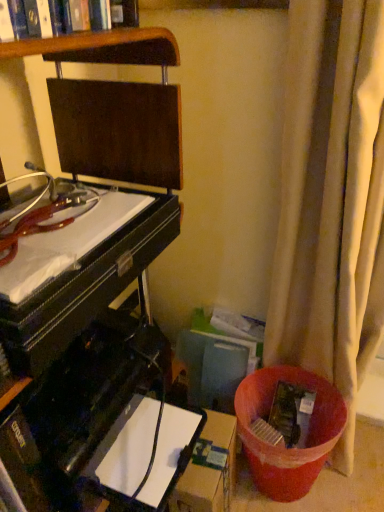
Question: From a real-world perspective, relative to beige fabric curtain at right, is black glossy computer desk at left vertically above or below?

Choices:
 (A) below
 (B) above

Answer: (B)

Question: Would you say black glossy computer desk at left is inside or outside beige fabric curtain at right?

Choices:
 (A) outside
 (B) inside

Answer: (A)

Question: Which object is the closest to the beige fabric curtain at right?

Choices:
 (A) black glossy computer desk at left
 (B) brown cardboard box at lower center

Answer: (A)

Question: Based on their relative distances, which object is nearer to the brown cardboard box at lower center?

Choices:
 (A) beige fabric curtain at right
 (B) black glossy computer desk at left

Answer: (B)